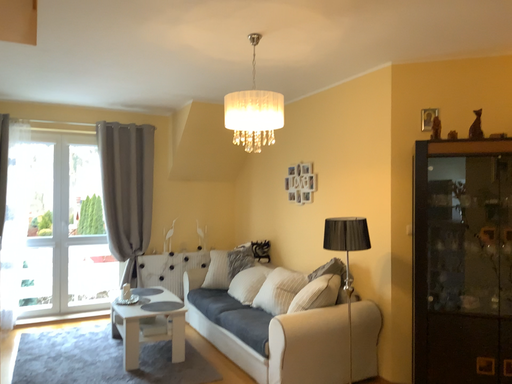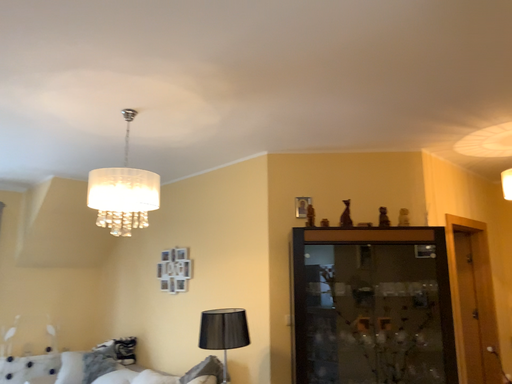
Question: How did the camera likely rotate when shooting the video?

Choices:
 (A) rotated right
 (B) rotated left

Answer: (A)